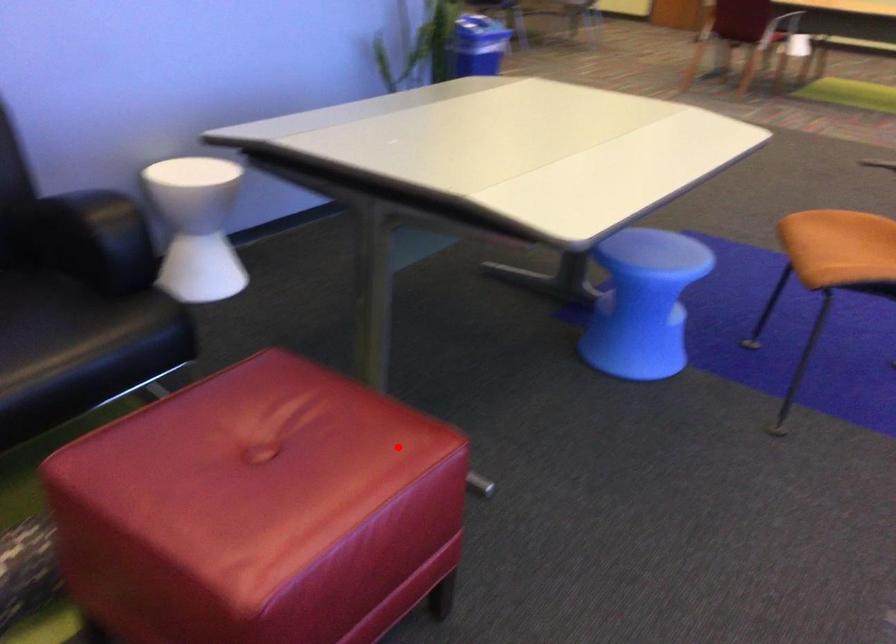
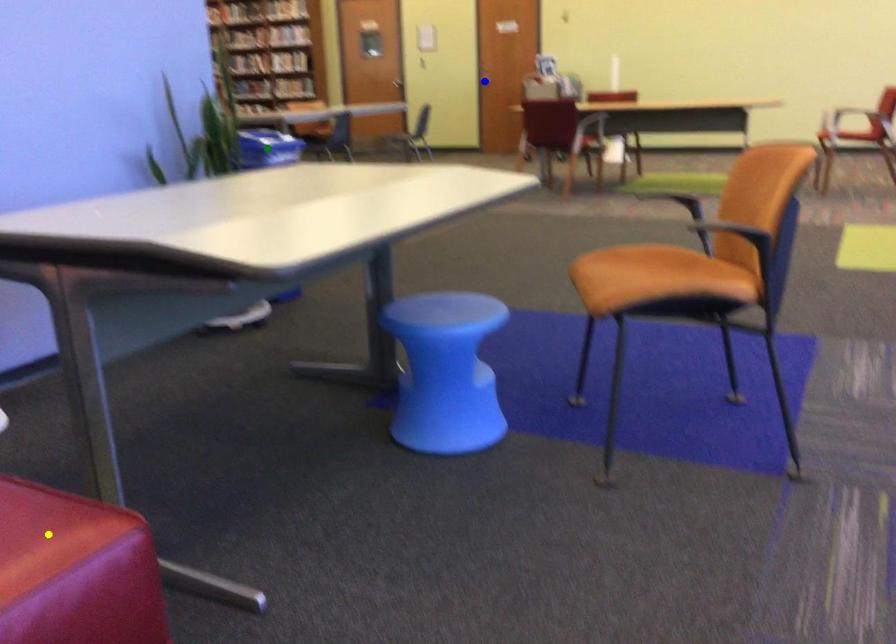
Question: I am providing you with two images of the same scene from different viewpoints. A red point is marked on the first image. You are given multiple points on the second image. Which mark in image 2 goes with the point in image 1?

Choices:
 (A) yellow point
 (B) green point
 (C) blue point

Answer: (A)